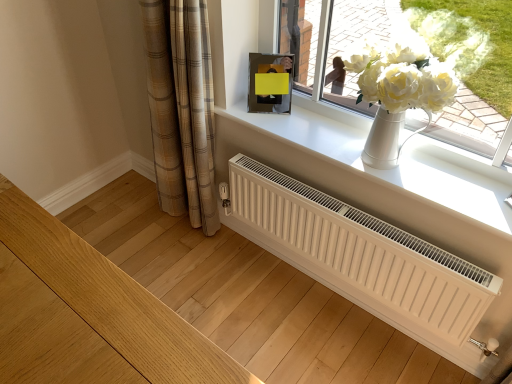
The width and height of the screenshot is (512, 384). I want to click on free space above white smooth window sill at upper center (from a real-world perspective), so click(x=351, y=150).